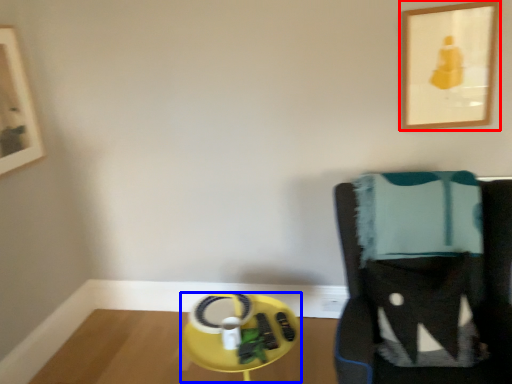
Question: Which object is closer to the camera taking this photo, picture frame (highlighted by a red box) or round table (highlighted by a blue box)?

Choices:
 (A) picture frame
 (B) round table

Answer: (B)